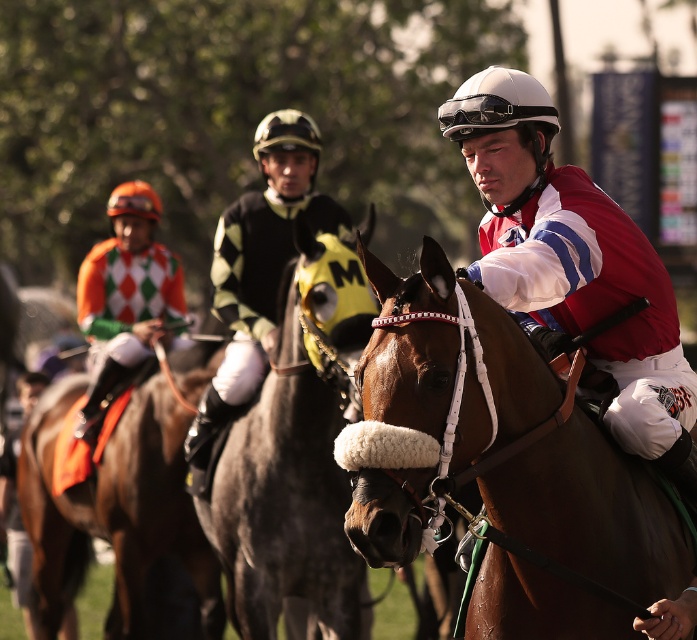
Question: Does matte red jacket at center have a smaller size compared to orange and white checkered fabric at left?

Choices:
 (A) yes
 (B) no

Answer: (A)

Question: Is brown glossy saddle at left positioned before orange and white checkered fabric at left?

Choices:
 (A) yes
 (B) no

Answer: (A)

Question: Which of the following is the farthest from the observer?

Choices:
 (A) brown glossy horse at center
 (B) brown glossy saddle at left

Answer: (B)

Question: Is brown glossy horse at center wider than orange and white checkered fabric at left?

Choices:
 (A) no
 (B) yes

Answer: (B)

Question: Which of the following is the farthest from the observer?

Choices:
 (A) shiny brown horse at center
 (B) brown glossy horse at center

Answer: (A)

Question: Which of the following is the farthest from the observer?

Choices:
 (A) (493, 241)
 (B) (245, 323)

Answer: (B)